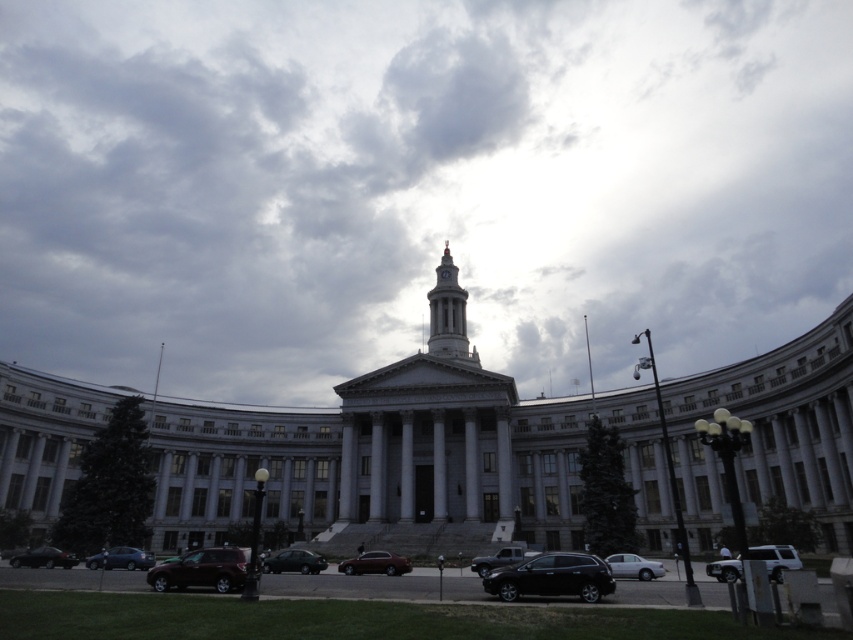
Question: Where is white marble tower at center located in relation to matte black car at lower left in the image?

Choices:
 (A) left
 (B) right

Answer: (B)

Question: Which object is closer to the camera taking this photo?

Choices:
 (A) matte black sedan at lower left
 (B) matte black car at lower left
 (C) silver metallic sedan at lower right

Answer: (C)

Question: From the image, what is the correct spatial relationship of cloudy sky at upper center in relation to silver metallic sedan at lower right?

Choices:
 (A) right
 (B) left

Answer: (B)

Question: Can you confirm if white marble bell tower at center is wider than metallic maroon sedan at center?

Choices:
 (A) no
 (B) yes

Answer: (A)

Question: Which point is closer to the camera?

Choices:
 (A) (630, 557)
 (B) (715, 576)
 (C) (311, 554)
 (D) (389, 420)

Answer: (B)

Question: Which point is farther to the camera?

Choices:
 (A) (296, 552)
 (B) (631, 561)
 (C) (416, 394)
 (D) (445, 339)

Answer: (D)